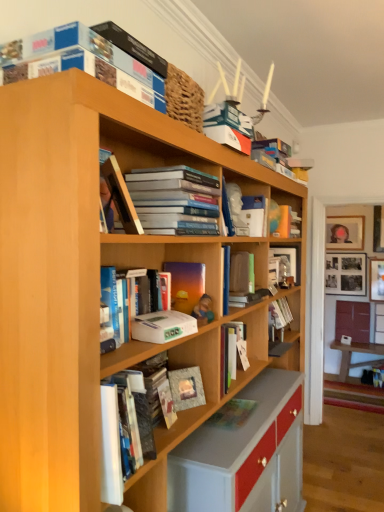
Question: From the image's perspective, would you say white matte paperback book at center, which is the 2th paperback book from back to front, is positioned over matte green book at center, arranged as the 5th book when viewed from the back?

Choices:
 (A) no
 (B) yes

Answer: (B)

Question: Considering the relative sizes of white matte paperback book at center, the 1th paperback book when ordered from top to bottom, and matte green book at center, the fifth book positioned from the front, in the image provided, is white matte paperback book at center, the 1th paperback book when ordered from top to bottom, thinner than matte green book at center, the fifth book positioned from the front,?

Choices:
 (A) no
 (B) yes

Answer: (B)

Question: From a real-world perspective, is white matte paperback book at center, the first paperback book positioned from the front, positioned over matte green book at center, the fifth book positioned from the front, based on gravity?

Choices:
 (A) yes
 (B) no

Answer: (A)

Question: From a real-world perspective, does white matte paperback book at center, which is the second paperback book in bottom-to-top order, sit lower than matte green book at center, arranged as the 5th book when viewed from the back?

Choices:
 (A) no
 (B) yes

Answer: (A)

Question: Is white matte paperback book at center, which is the 2th paperback book from back to front, positioned with its back to matte green book at center, arranged as the 5th book when viewed from the back?

Choices:
 (A) no
 (B) yes

Answer: (A)

Question: Considering the relative sizes of white matte paperback book at center, which is the second paperback book in bottom-to-top order, and matte green book at center, the fifth book positioned from the front, in the image provided, is white matte paperback book at center, which is the second paperback book in bottom-to-top order, shorter than matte green book at center, the fifth book positioned from the front,?

Choices:
 (A) yes
 (B) no

Answer: (B)

Question: Is matte blue book at upper center, marked as the 4th book in a back-to-front arrangement, shorter than hardcover book at upper center, which is counted as the second book, starting from the front?

Choices:
 (A) no
 (B) yes

Answer: (B)

Question: Does matte blue book at upper center, marked as the 4th book in a back-to-front arrangement, appear on the left side of hardcover book at upper center, the 8th book in the back-to-front sequence?

Choices:
 (A) yes
 (B) no

Answer: (B)

Question: Does matte blue book at upper center, marked as the 4th book in a back-to-front arrangement, have a greater height compared to hardcover book at upper center, the 8th book in the back-to-front sequence?

Choices:
 (A) yes
 (B) no

Answer: (B)

Question: Does matte blue book at upper center, the 6th book positioned from the front, contain hardcover book at upper center, which is counted as the second book, starting from the front?

Choices:
 (A) yes
 (B) no

Answer: (B)

Question: Is matte blue book at upper center, the 6th book positioned from the front, not inside hardcover book at upper center, the 8th book in the back-to-front sequence?

Choices:
 (A) no
 (B) yes

Answer: (B)

Question: Could you tell me if matte blue book at upper center, marked as the 4th book in a back-to-front arrangement, is turned towards hardcover book at upper center, the 8th book in the back-to-front sequence?

Choices:
 (A) no
 (B) yes

Answer: (A)

Question: From a real-world perspective, is wooden bookshelf at right located higher than blue cardboard box at upper center, which is counted as the 1th book, starting from the front?

Choices:
 (A) yes
 (B) no

Answer: (B)